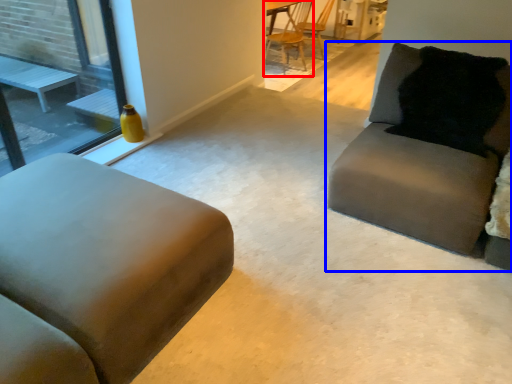
Question: Which point is further to the camera, chair (highlighted by a red box) or studio couch (highlighted by a blue box)?

Choices:
 (A) chair
 (B) studio couch

Answer: (A)